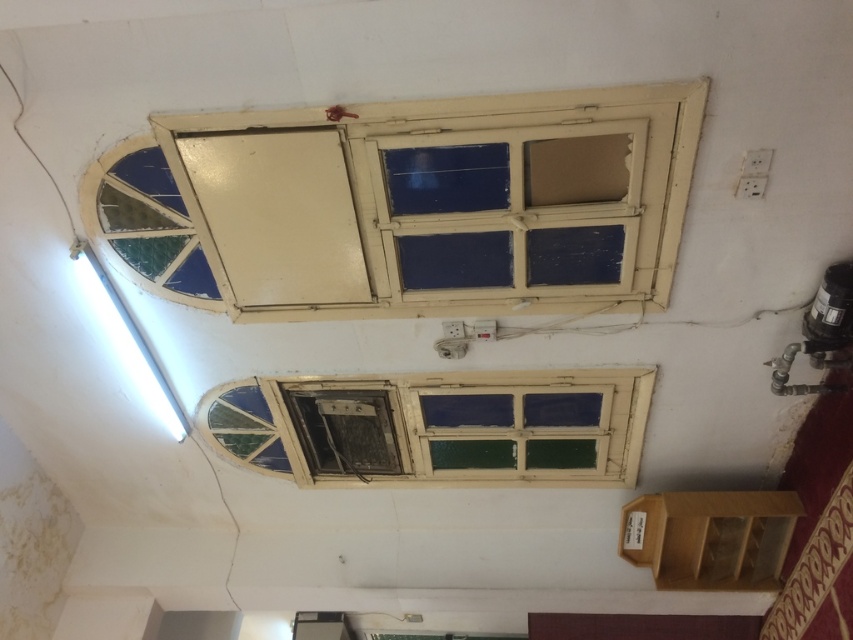
Between matte cream window frame at upper center and wooden window frame at center, which one is positioned higher?

matte cream window frame at upper center

Can you confirm if matte cream window frame at upper center is wider than wooden window frame at center?

Yes, matte cream window frame at upper center is wider than wooden window frame at center.

Does point (659, 173) come in front of point (228, 385)?

Yes, point (659, 173) is closer to viewer.

This screenshot has height=640, width=853. What are the coordinates of `matte cream window frame at upper center` in the screenshot? It's located at (410, 205).